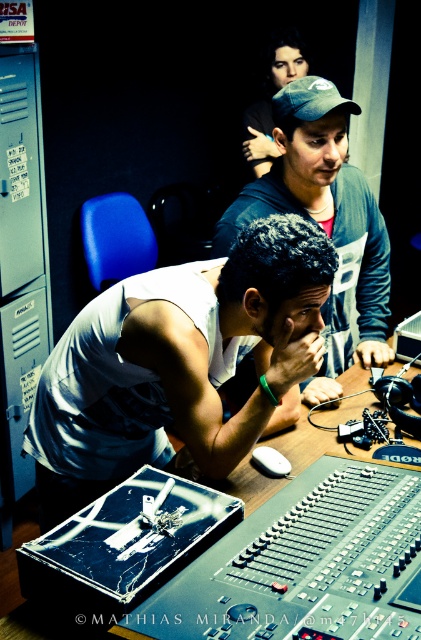
You are standing in the recording studio and want to reach the point marked at coordinate point (277, 288). If your arm can reach up to 2 feet, can you touch it without moving your feet?

The point marked at coordinate point (277, 288) is 4.14 feet away from the camera, so no, you cannot touch it with your arm which can only reach up to 2 feet without moving your feet.

You are a photographer in the studio and need to position a light to the right of both the white matte tank top at center and the matte blue cap at center. Which object should the light be placed to the right of first?

The light should be placed to the right of the matte blue cap at center first because the white matte tank top at center is already to the left of the matte blue cap at center, so positioning the light to the right of the matte blue cap at center will naturally place it to the right of both objects.